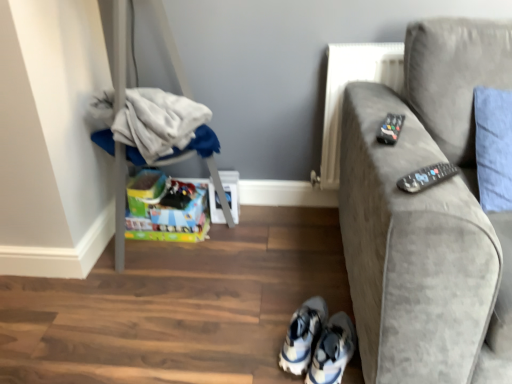
Question: Is white mesh sneakers at lower center, the first footwear from the left, to the left of black plastic remote at right, the second remote from the top, from the viewer's perspective?

Choices:
 (A) no
 (B) yes

Answer: (B)

Question: From a real-world perspective, is white mesh sneakers at lower center, the first footwear from the left, positioned over black plastic remote at right, the second remote from the top, based on gravity?

Choices:
 (A) yes
 (B) no

Answer: (B)

Question: Considering the relative positions of white mesh sneakers at lower center, which is counted as the 2th footwear, starting from the right, and black plastic remote at right, which is the 2th remote from back to front, in the image provided, is white mesh sneakers at lower center, which is counted as the 2th footwear, starting from the right, behind black plastic remote at right, which is the 2th remote from back to front,?

Choices:
 (A) yes
 (B) no

Answer: (A)

Question: Can you confirm if white mesh sneakers at lower center, the first footwear from the left, is bigger than black plastic remote at right, arranged as the 1th remote when ordered from the bottom?

Choices:
 (A) yes
 (B) no

Answer: (A)

Question: Considering the relative positions of white mesh sneakers at lower center, the first footwear from the left, and black plastic remote at right, which is the 2th remote from back to front, in the image provided, is white mesh sneakers at lower center, the first footwear from the left, in front of black plastic remote at right, which is the 2th remote from back to front,?

Choices:
 (A) yes
 (B) no

Answer: (B)

Question: Is black plastic remote at right, the second remote from the top, completely or partially inside white mesh sneakers at lower center, the first footwear from the left?

Choices:
 (A) yes
 (B) no

Answer: (B)

Question: Does white fabric at left have a lesser height compared to velvet gray couch at right?

Choices:
 (A) yes
 (B) no

Answer: (A)

Question: From a real-world perspective, is white fabric at left below velvet gray couch at right?

Choices:
 (A) no
 (B) yes

Answer: (A)

Question: From the image's perspective, is white fabric at left above velvet gray couch at right?

Choices:
 (A) yes
 (B) no

Answer: (A)

Question: Does white fabric at left have a greater width compared to velvet gray couch at right?

Choices:
 (A) yes
 (B) no

Answer: (B)

Question: Is white fabric at left closer to camera compared to velvet gray couch at right?

Choices:
 (A) yes
 (B) no

Answer: (B)

Question: Does white fabric at left have a smaller size compared to velvet gray couch at right?

Choices:
 (A) yes
 (B) no

Answer: (A)

Question: Does white fabric at left have a larger size compared to black plastic remote at right, which is the 1th remote from front to back?

Choices:
 (A) no
 (B) yes

Answer: (B)